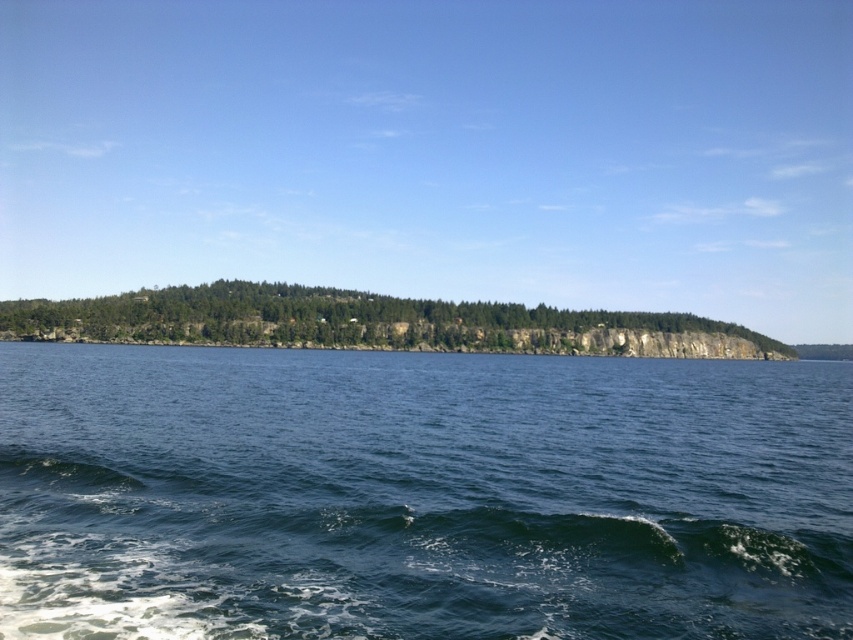
Question: Can you confirm if dark blue water at center is wider than green leafy trees at center?

Choices:
 (A) yes
 (B) no

Answer: (B)

Question: Can you confirm if dark blue water at center is wider than green leafy trees at center?

Choices:
 (A) no
 (B) yes

Answer: (A)

Question: Is dark blue water at center to the right of green leafy trees at center from the viewer's perspective?

Choices:
 (A) yes
 (B) no

Answer: (B)

Question: Which point is closer to the camera?

Choices:
 (A) (256, 291)
 (B) (90, 552)

Answer: (B)